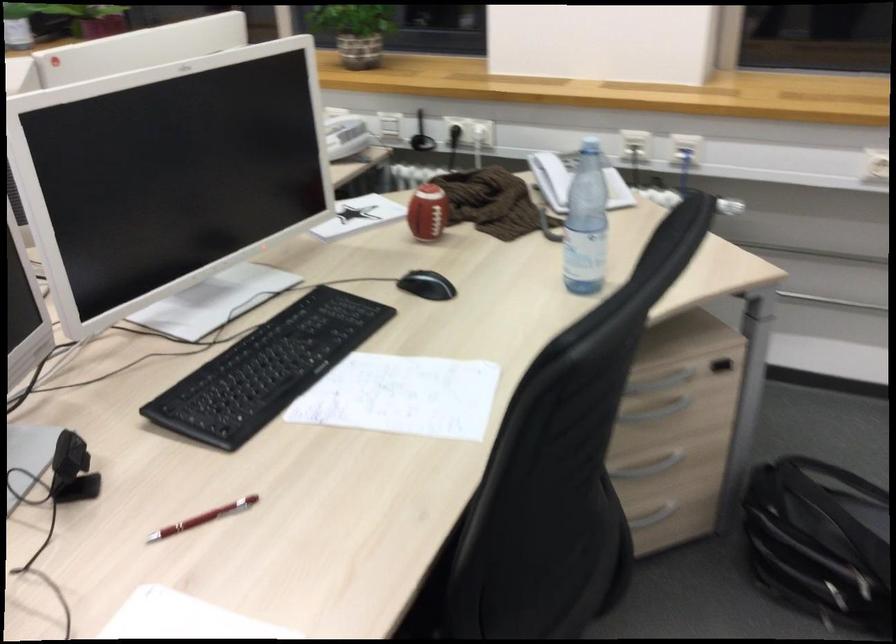
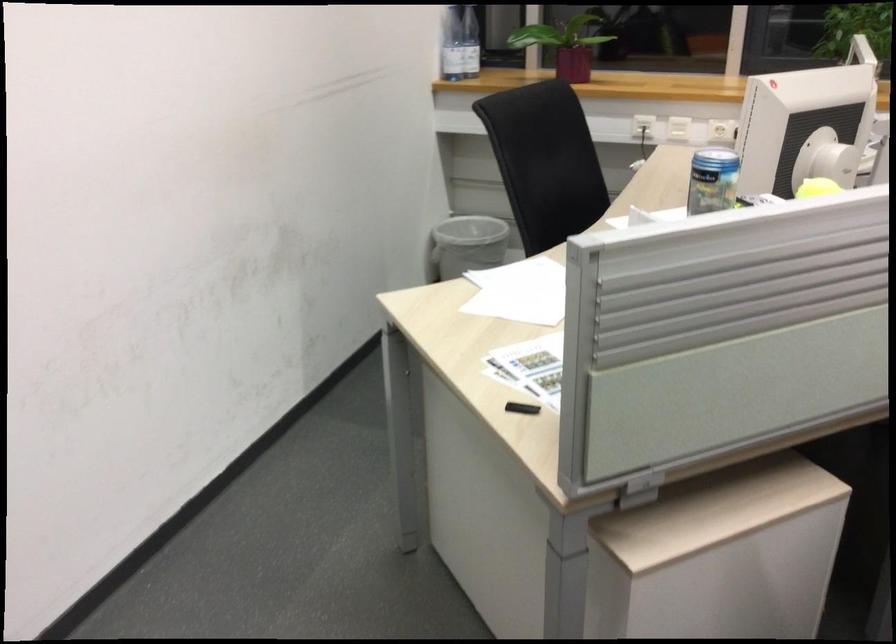
Question: Which direction would the cameraman need to move to produce the second image? Reply with the corresponding letter.

Choices:
 (A) Left
 (B) Right
 (C) Forward
 (D) Backward

Answer: (A)